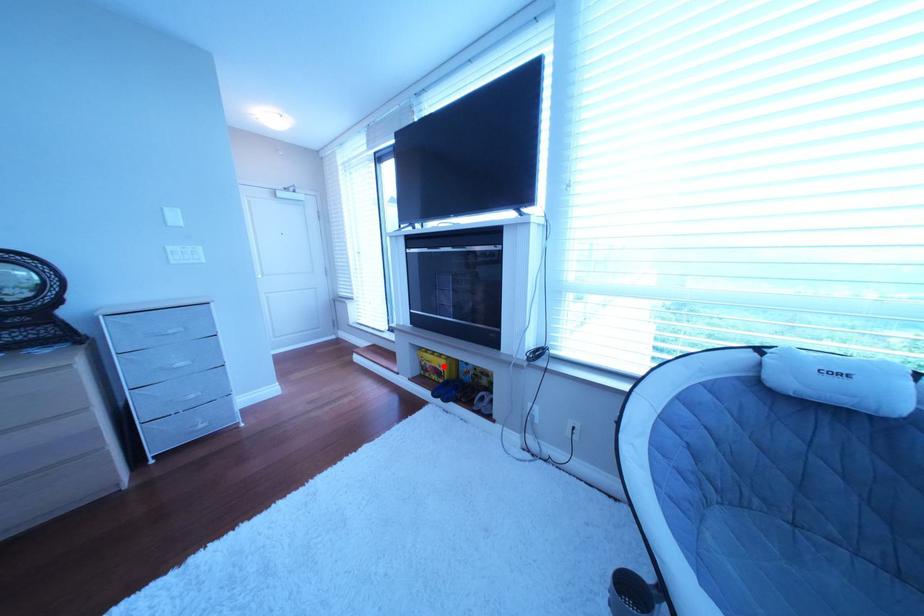
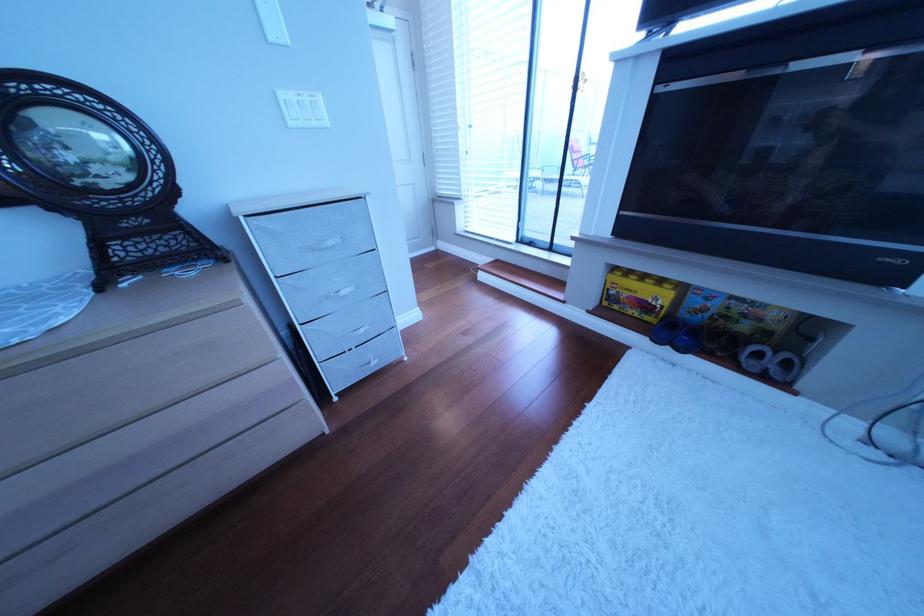
Question: A red point is marked in image1. In image2, is the corresponding 3D point closer to the camera or farther? Reply with the corresponding letter.

Choices:
 (A) The corresponding 3D point is closer.
 (B) The corresponding 3D point is farther.

Answer: (A)